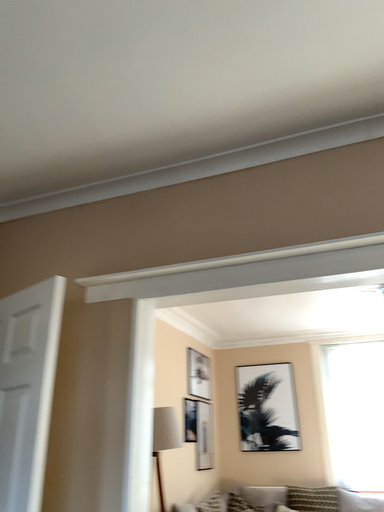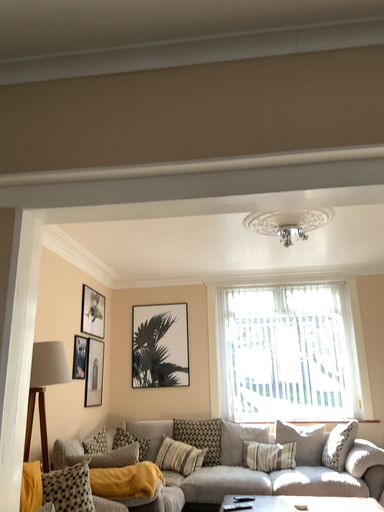
Question: How did the camera likely rotate when shooting the video?

Choices:
 (A) rotated left
 (B) rotated right

Answer: (B)